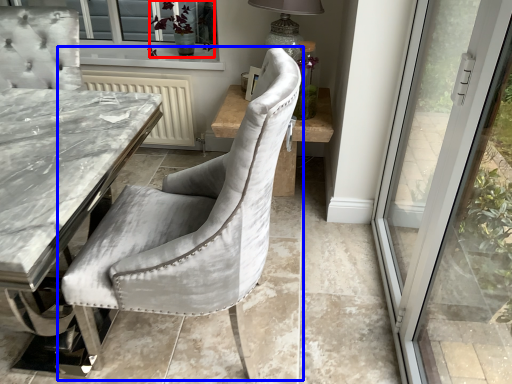
Question: Which of the following is the closest to the observer, plant (highlighted by a red box) or chair (highlighted by a blue box)?

Choices:
 (A) plant
 (B) chair

Answer: (B)